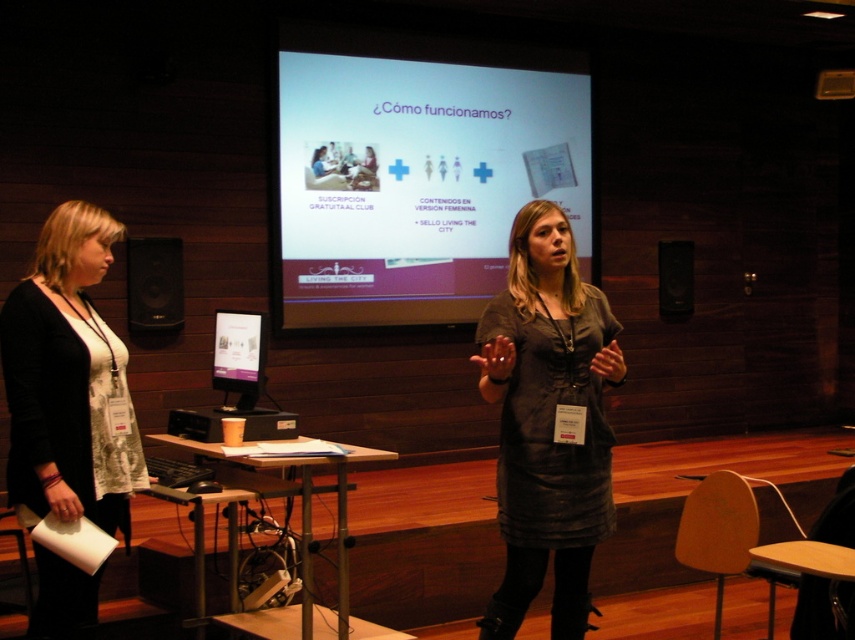
You are a photographer setting up for a presentation in the conference room. You need to focus your camera on two points marked in the image. The first point is at coordinate point (338, 67) and the second is at point (497, 384). Which point should you focus on first to ensure proper depth of field for both points?

You should focus on point (338, 67) first since it is closer to the camera than point (497, 384). This ensures the closer point is in focus, and the depth of field will likely cover the farther point as well.

You are organizing a presentation and need to ensure that both the white matte projection screen at center and the dark gray dress at center are visible to the audience. Given their sizes, which object will appear larger to the audience?

The white matte projection screen at center will appear larger to the audience because it has a larger size compared to the dark gray dress at center.